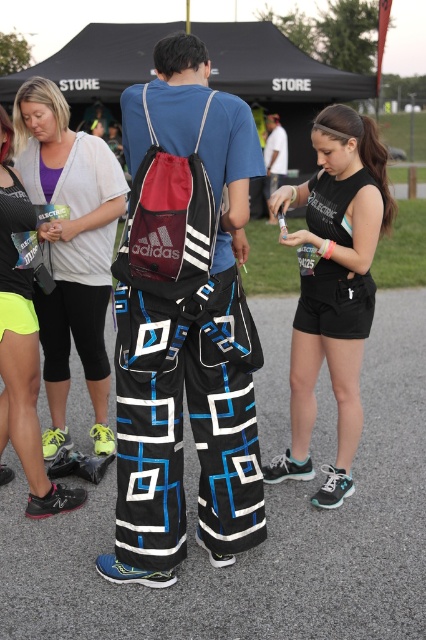
Who is positioned more to the right, neon yellow leggings at lower left or white cotton t-shirt at center?

From the viewer's perspective, white cotton t-shirt at center appears more on the right side.

Locate an element on the screen. neon yellow leggings at lower left is located at coordinates (71, 250).

Does point (75, 156) come farther from viewer compared to point (276, 115)?

No, (75, 156) is in front of (276, 115).

Identify the location of neon yellow leggings at lower left. Image resolution: width=426 pixels, height=640 pixels. (71, 250).

Between point (108, 224) and point (158, 240), which one is positioned behind?

Positioned behind is point (108, 224).

Does neon yellow leggings at lower left lie behind red mesh backpack at center?

Yes.

Image resolution: width=426 pixels, height=640 pixels. What do you see at coordinates (71, 250) in the screenshot?
I see `neon yellow leggings at lower left` at bounding box center [71, 250].

Where is `neon yellow leggings at lower left`? The height and width of the screenshot is (640, 426). neon yellow leggings at lower left is located at coordinates (71, 250).

Is the position of black matte shorts at lower right less distant than that of neon yellow leggings at lower left?

Yes, it is.

Is black matte shorts at lower right wider than neon yellow leggings at lower left?

Correct, the width of black matte shorts at lower right exceeds that of neon yellow leggings at lower left.

Does point (333, 364) lie behind point (45, 160)?

No.

This screenshot has width=426, height=640. What are the coordinates of `black matte shorts at lower right` in the screenshot? It's located at (333, 289).